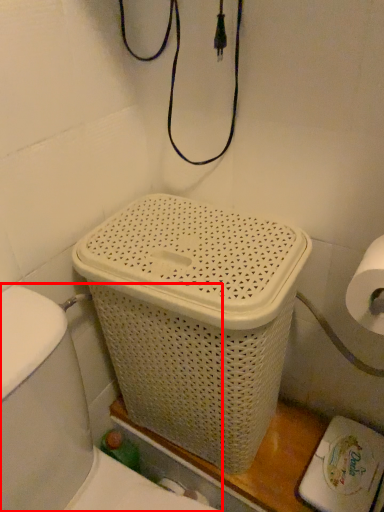
Question: In this image, where is sink (annotated by the red box) located relative to basket container?

Choices:
 (A) left
 (B) right

Answer: (A)